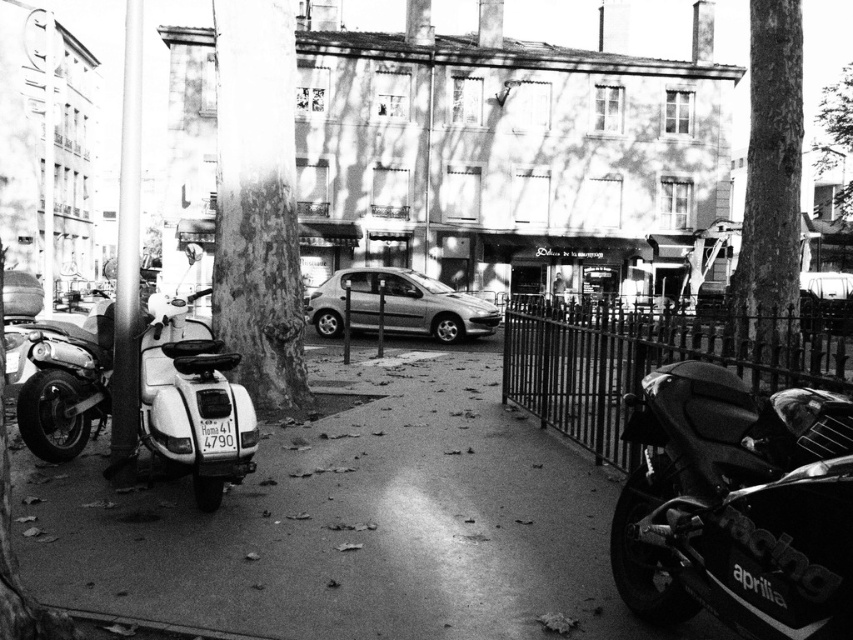
Question: Which point is closer to the camera?

Choices:
 (A) rough bark tree at upper right
 (B) smooth asphalt pavement at center

Answer: (B)

Question: Which of the following is the farthest from the observer?

Choices:
 (A) white matte scooter at left
 (B) smooth bark tree at center

Answer: (B)

Question: Is smooth asphalt pavement at center smaller than rough bark tree at upper right?

Choices:
 (A) no
 (B) yes

Answer: (B)

Question: Which object appears closest to the camera in this image?

Choices:
 (A) smooth bark tree at center
 (B) smooth asphalt pavement at center

Answer: (B)

Question: Considering the relative positions of shiny black motorcycle at right and metallic silver car at center in the image provided, where is shiny black motorcycle at right located with respect to metallic silver car at center?

Choices:
 (A) above
 (B) below

Answer: (B)

Question: Can you confirm if smooth bark tree at center is thinner than smooth bark tree at upper right?

Choices:
 (A) no
 (B) yes

Answer: (B)